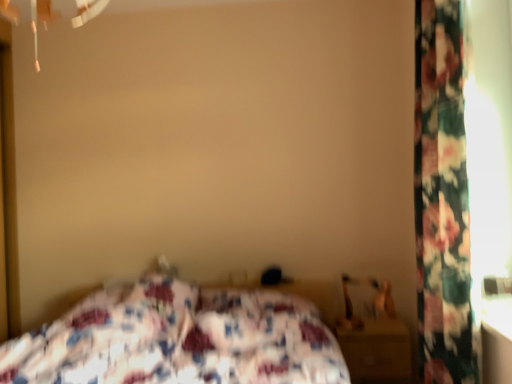
The width and height of the screenshot is (512, 384). What do you see at coordinates (442, 198) in the screenshot? I see `floral fabric curtain at right` at bounding box center [442, 198].

Locate an element on the screen. This screenshot has width=512, height=384. floral fabric curtain at right is located at coordinates (442, 198).

Where is `floral fabric curtain at right`? floral fabric curtain at right is located at coordinates (442, 198).

Considering the relative positions of floral fabric bed at center and floral fabric curtain at right in the image provided, is floral fabric bed at center behind floral fabric curtain at right?

No, it is in front of floral fabric curtain at right.

Considering the relative positions of floral fabric bed at center and floral fabric curtain at right in the image provided, is floral fabric bed at center to the left or to the right of floral fabric curtain at right?

floral fabric bed at center is to the left of floral fabric curtain at right.

Is floral fabric bed at center oriented towards floral fabric curtain at right?

No, floral fabric bed at center is not turned towards floral fabric curtain at right.

Is floral fabric bed at center taller than floral fabric curtain at right?

No, floral fabric bed at center is not taller than floral fabric curtain at right.

I want to click on nightstand that is on the left side of floral fabric curtain at right, so click(x=377, y=351).

Is point (356, 366) in front of point (428, 98)?

No, it is behind (428, 98).

From the image's perspective, is wooden nightstand at lower right positioned above or below floral fabric curtain at right?

wooden nightstand at lower right is below floral fabric curtain at right.

Is wooden nightstand at lower right placed right next to floral fabric curtain at right?

No, wooden nightstand at lower right is not beside floral fabric curtain at right.

Are floral fabric curtain at right and wooden nightstand at lower right far apart?

No, floral fabric curtain at right is in close proximity to wooden nightstand at lower right.

Identify the location of nightstand that is behind the floral fabric curtain at right. The image size is (512, 384). (377, 351).

Between floral fabric curtain at right and wooden nightstand at lower right, which one has more height?

floral fabric curtain at right.

Between floral fabric curtain at right and wooden nightstand at lower right, which one has larger size?

floral fabric curtain at right.

Looking at this image, between floral fabric bed at center and wooden nightstand at lower right, which one has less height?

wooden nightstand at lower right is shorter.

How much distance is there between floral fabric bed at center and wooden nightstand at lower right?

floral fabric bed at center and wooden nightstand at lower right are 28.53 inches apart from each other.

Can you tell me how much floral fabric bed at center and wooden nightstand at lower right differ in facing direction?

There is a 0.127-degree angle between the facing directions of floral fabric bed at center and wooden nightstand at lower right.

From a real-world perspective, is floral fabric bed at center above or below wooden nightstand at lower right?

floral fabric bed at center is situated higher than wooden nightstand at lower right in the real world.

Based on their sizes in the image, would you say floral fabric curtain at right is bigger or smaller than floral fabric bed at center?

Clearly, floral fabric curtain at right is smaller in size than floral fabric bed at center.

Who is shorter, floral fabric curtain at right or floral fabric bed at center?

floral fabric bed at center is shorter.

Is floral fabric curtain at right closer to the viewer compared to floral fabric bed at center?

No, it is not.

Is wooden nightstand at lower right positioned with its back to floral fabric bed at center?

No, wooden nightstand at lower right is not facing the opposite direction of floral fabric bed at center.

Does wooden nightstand at lower right have a greater width compared to floral fabric bed at center?

In fact, wooden nightstand at lower right might be narrower than floral fabric bed at center.

Is wooden nightstand at lower right surrounding floral fabric bed at center?

No, floral fabric bed at center is not surrounded by wooden nightstand at lower right.

Does wooden nightstand at lower right lie behind floral fabric bed at center?

That is True.

The height and width of the screenshot is (384, 512). What are the coordinates of `bed that is in front of the floral fabric curtain at right` in the screenshot? It's located at (178, 339).

This screenshot has height=384, width=512. I want to click on curtain on the right of wooden nightstand at lower right, so click(442, 198).

Looking at the image, which one is located closer to floral fabric curtain at right, wooden nightstand at lower right or floral fabric bed at center?

Among the two, wooden nightstand at lower right is located nearer to floral fabric curtain at right.

Considering their positions, is floral fabric bed at center positioned closer to wooden nightstand at lower right than floral fabric curtain at right?

The object closer to wooden nightstand at lower right is floral fabric bed at center.

Looking at the image, which one is located closer to floral fabric bed at center, floral fabric curtain at right or wooden nightstand at lower right?

wooden nightstand at lower right is closer to floral fabric bed at center.

Estimate the real-world distances between objects in this image. Which object is further from floral fabric curtain at right, floral fabric bed at center or wooden nightstand at lower right?

The object further to floral fabric curtain at right is floral fabric bed at center.

Estimate the real-world distances between objects in this image. Which object is further from floral fabric bed at center, wooden nightstand at lower right or floral fabric curtain at right?

floral fabric curtain at right is further to floral fabric bed at center.

When comparing their distances from wooden nightstand at lower right, does floral fabric curtain at right or floral fabric bed at center seem further?

floral fabric curtain at right is positioned further to the anchor wooden nightstand at lower right.

Identify the location of curtain between floral fabric bed at center and wooden nightstand at lower right from front to back. Image resolution: width=512 pixels, height=384 pixels. [442, 198].